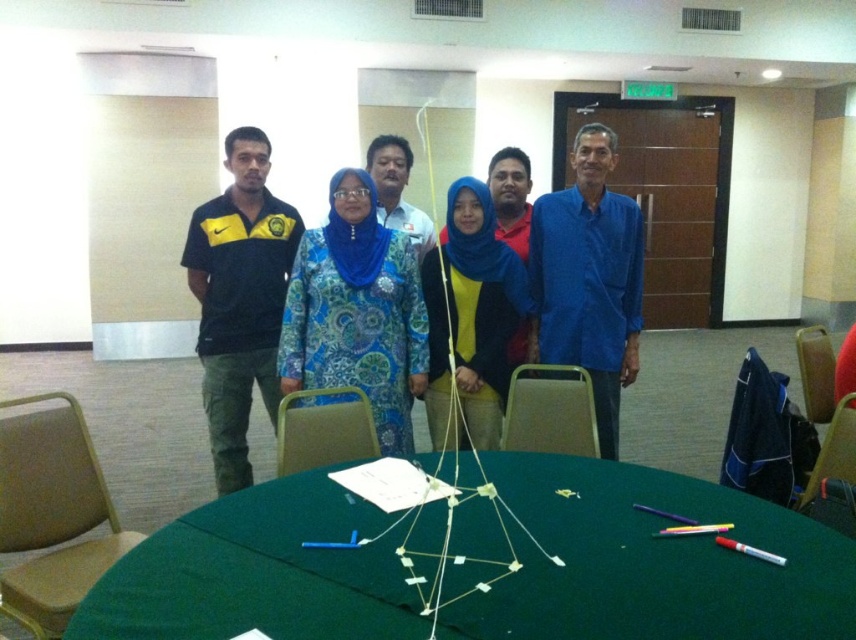
Is point (789, 541) closer to camera compared to point (348, 220)?

Yes, it is in front of point (348, 220).

Does point (488, 472) come behind point (333, 280)?

No, (488, 472) is closer to viewer.

Between point (590, 545) and point (366, 352), which one is positioned in front?

Point (590, 545) is more forward.

Where is `green fabric table at center`? green fabric table at center is located at coordinates (652, 561).

Is point (387, 250) positioned behind point (244, 221)?

No, (387, 250) is in front of (244, 221).

Is blue printed dress at center smaller than matte black polo shirt at left?

Correct, blue printed dress at center occupies less space than matte black polo shirt at left.

What do you see at coordinates (357, 310) in the screenshot? I see `blue printed dress at center` at bounding box center [357, 310].

Locate an element on the screen. blue printed dress at center is located at coordinates (357, 310).

Is point (389, 294) less distant than point (609, 317)?

Yes, point (389, 294) is in front of point (609, 317).

Which is below, blue printed dress at center or blue matte shirt at center?

blue printed dress at center is below.

Where is `blue printed dress at center`? This screenshot has height=640, width=856. blue printed dress at center is located at coordinates (357, 310).

The width and height of the screenshot is (856, 640). What are the coordinates of `blue printed dress at center` in the screenshot? It's located at (357, 310).